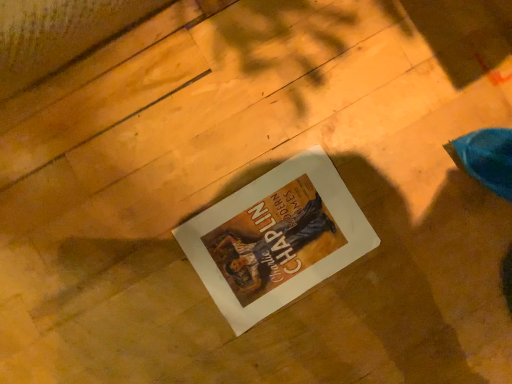
Question: Should I look upward or downward to see matte paper poster at center?

Choices:
 (A) down
 (B) up

Answer: (A)